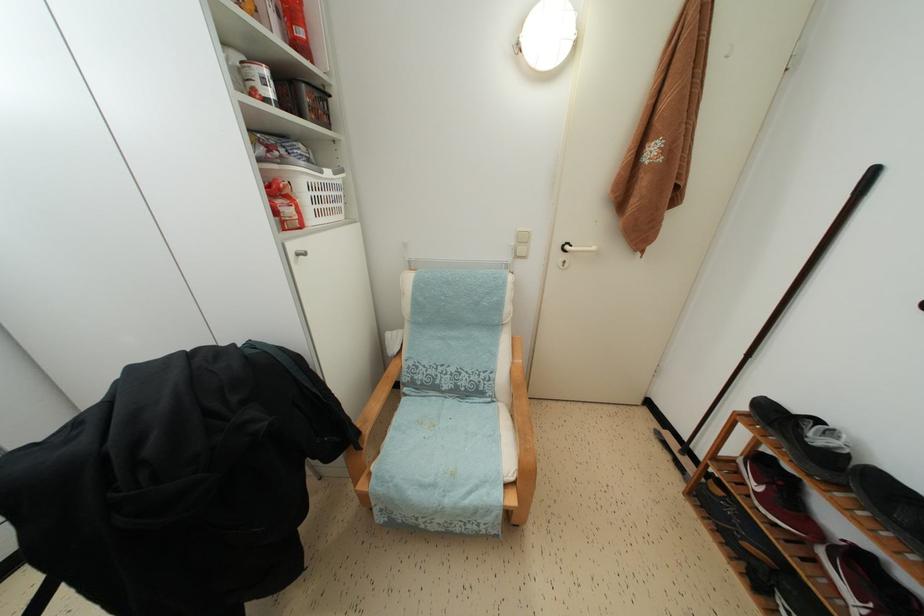
Find where to pull the silver cabinet handle. Please return your answer as a coordinate pair (x, y).

(300, 253)